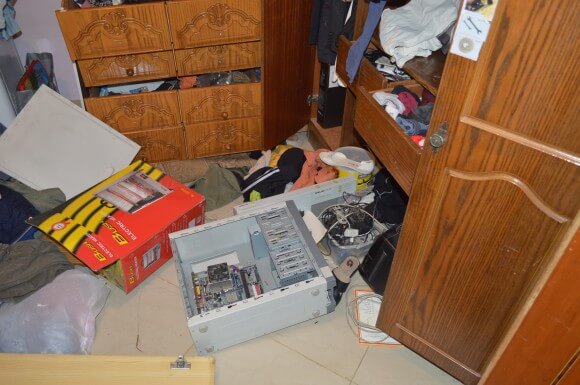
Locate an element on the screen. This screenshot has width=580, height=385. brown hardwood drawer is located at coordinates (392, 150).